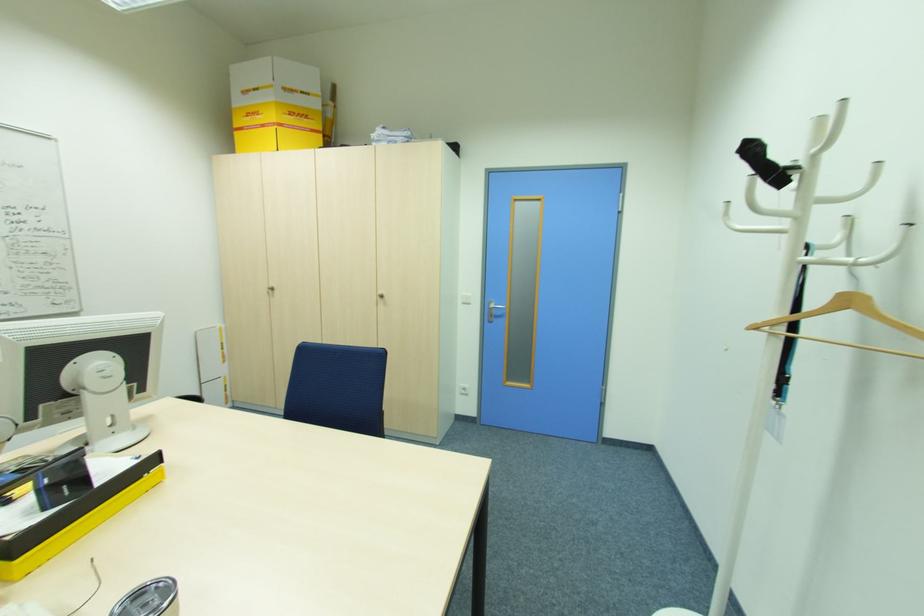
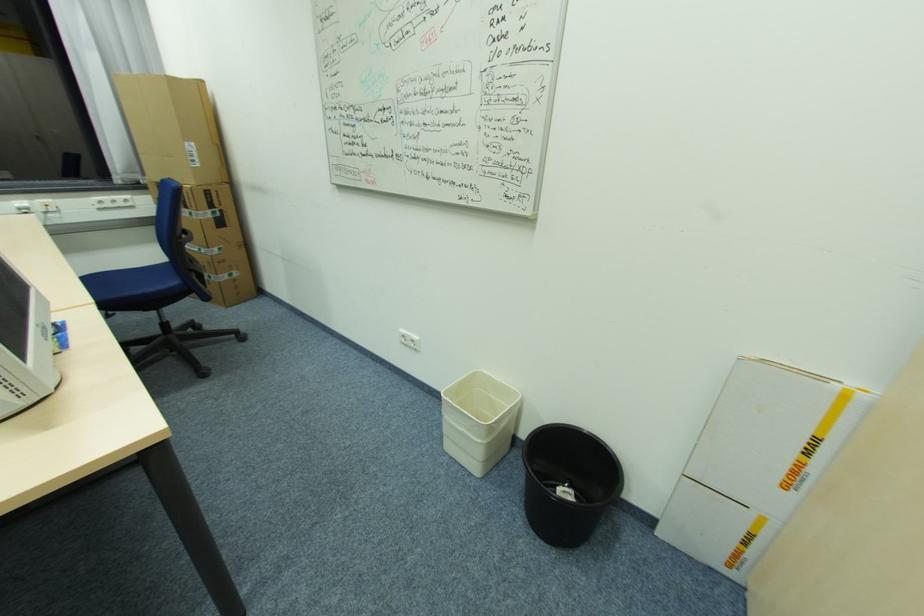
Where in the second image is the point corresponding to point (227, 387) from the first image?

(752, 535)